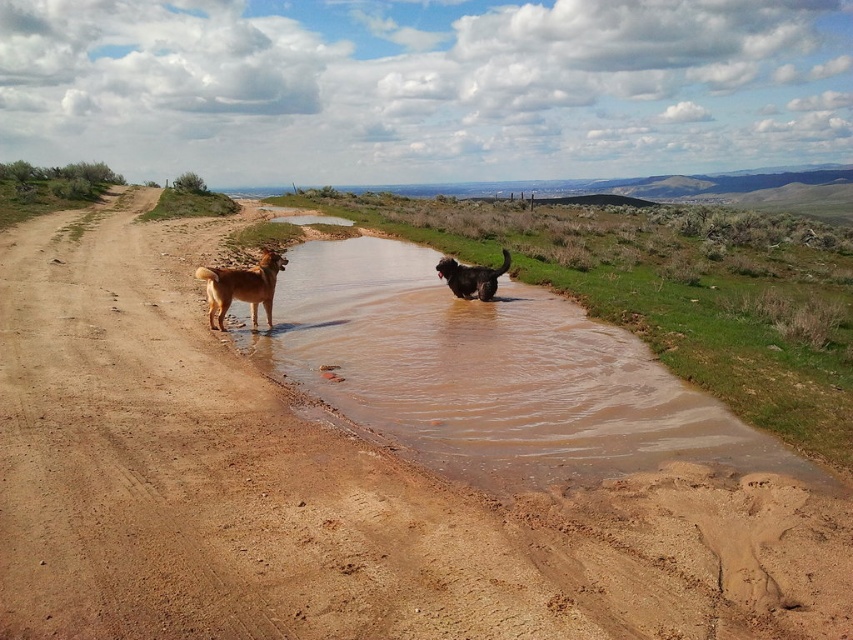
You are a dog owner observing your two dogs in the rural scene. You notice the brown sandy dirt at center and the shiny black fur at center. Which dog is closer to the puddle?

The shiny black fur at center is closer to the puddle because the brown sandy dirt at center is in front of it, meaning the shiny black fur is behind the dirt and thus nearer to the puddle.